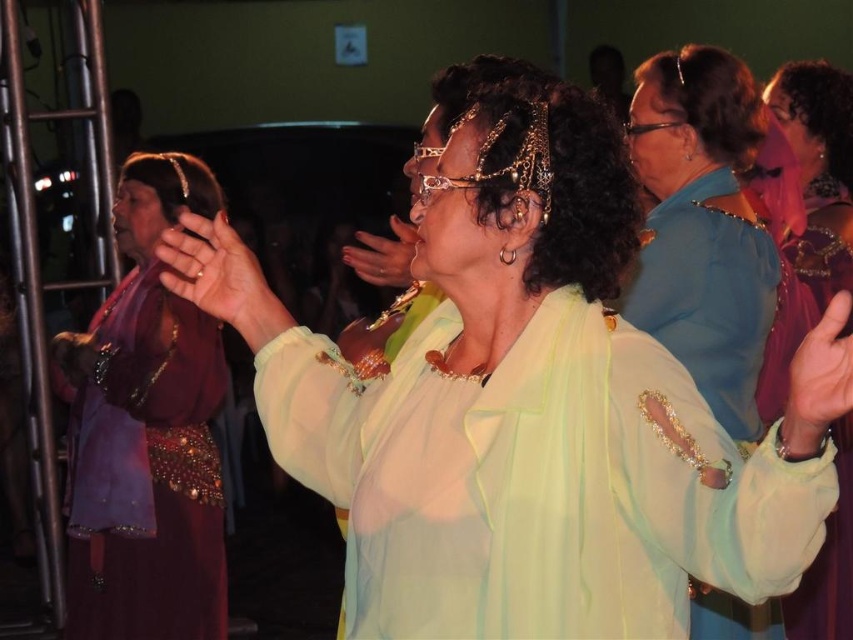
Question: Is the position of matte gold ring at center more distant than that of translucent yellow hand at center?

Choices:
 (A) yes
 (B) no

Answer: (B)

Question: Considering the relative positions of shiny gold necklace at upper right and translucent yellow hand at center in the image provided, where is shiny gold necklace at upper right located with respect to translucent yellow hand at center?

Choices:
 (A) above
 (B) below

Answer: (A)

Question: Among these points, which one is nearest to the camera?

Choices:
 (A) (178, 253)
 (B) (653, 115)

Answer: (A)

Question: Which point is closer to the camera taking this photo?

Choices:
 (A) (386, 282)
 (B) (131, 461)

Answer: (A)

Question: Can you confirm if light green sheer blouse at center is positioned to the left of matte gold ring at center?

Choices:
 (A) no
 (B) yes

Answer: (A)

Question: Which point is closer to the camera taking this photo?

Choices:
 (A) (364, 278)
 (B) (682, 394)
 (C) (828, 321)

Answer: (C)